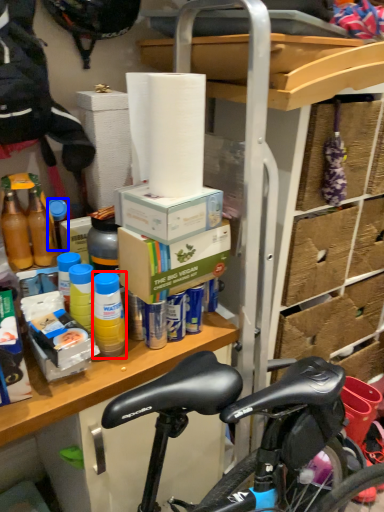
Question: Which of the following is the closest to the observer, bottle (highlighted by a red box) or bottle (highlighted by a blue box)?

Choices:
 (A) bottle
 (B) bottle

Answer: (A)